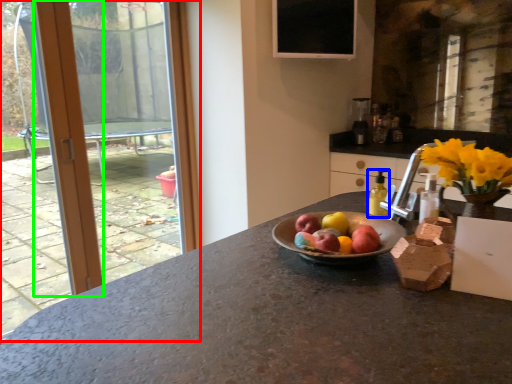
Question: Which object is the closest to the window (highlighted by a red box)? Choose among these: bottle (highlighted by a blue box) or door (highlighted by a green box).

Choices:
 (A) bottle
 (B) door

Answer: (B)